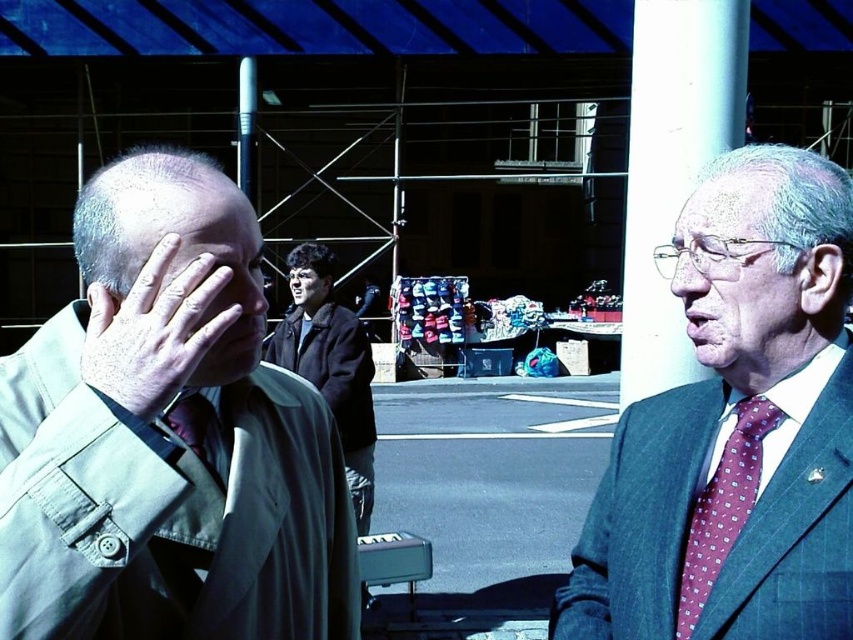
You are standing at the center of the scene. Based on the coordinates provided, in which direction would you need to look to see the khaki fabric jacket at left?

The khaki fabric jacket at left is located at coordinates point (167, 436). Since the x coordinate is 0.684, which is greater than 0.5, it is to the right of the center. Therefore, you would need to look to the right to see the khaki fabric jacket at left.

You are standing at the entrance of the market and want to find the blue plaid suit at right. According to the coordinates provided, in which direction should you look to locate it?

The blue plaid suit at right is located at point 0.673 on the x and 0.865 on the y, so you should look to the upper right direction from your current position.